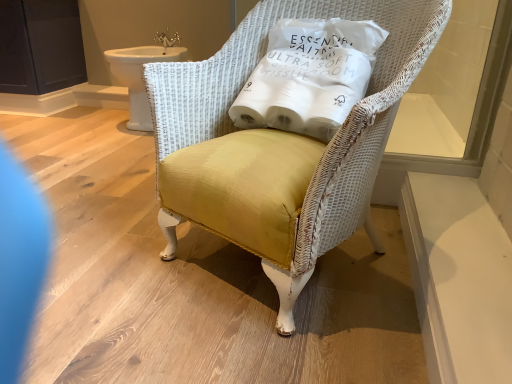
Question: Is the depth of transparent glass window at upper right greater than that of white wicker chair at center?

Choices:
 (A) no
 (B) yes

Answer: (B)

Question: From a real-world perspective, is transparent glass window at upper right physically above white wicker chair at center?

Choices:
 (A) yes
 (B) no

Answer: (A)

Question: Does transparent glass window at upper right come in front of white wicker chair at center?

Choices:
 (A) no
 (B) yes

Answer: (A)

Question: Is transparent glass window at upper right outside white wicker chair at center?

Choices:
 (A) yes
 (B) no

Answer: (A)

Question: Would you consider transparent glass window at upper right to be distant from white wicker chair at center?

Choices:
 (A) yes
 (B) no

Answer: (B)

Question: Is transparent glass window at upper right smaller than white wicker chair at center?

Choices:
 (A) yes
 (B) no

Answer: (A)

Question: Does transparent glass window at upper right contain dark matte cabinet at upper left?

Choices:
 (A) yes
 (B) no

Answer: (B)

Question: From the image's perspective, is transparent glass window at upper right under dark matte cabinet at upper left?

Choices:
 (A) no
 (B) yes

Answer: (B)

Question: From a real-world perspective, is transparent glass window at upper right under dark matte cabinet at upper left?

Choices:
 (A) yes
 (B) no

Answer: (B)

Question: Is transparent glass window at upper right oriented away from dark matte cabinet at upper left?

Choices:
 (A) yes
 (B) no

Answer: (B)

Question: Is transparent glass window at upper right with dark matte cabinet at upper left?

Choices:
 (A) yes
 (B) no

Answer: (B)

Question: Is transparent glass window at upper right positioned behind dark matte cabinet at upper left?

Choices:
 (A) no
 (B) yes

Answer: (A)

Question: From the image's perspective, is transparent glass window at upper right over white fabric pillow at upper center?

Choices:
 (A) yes
 (B) no

Answer: (A)